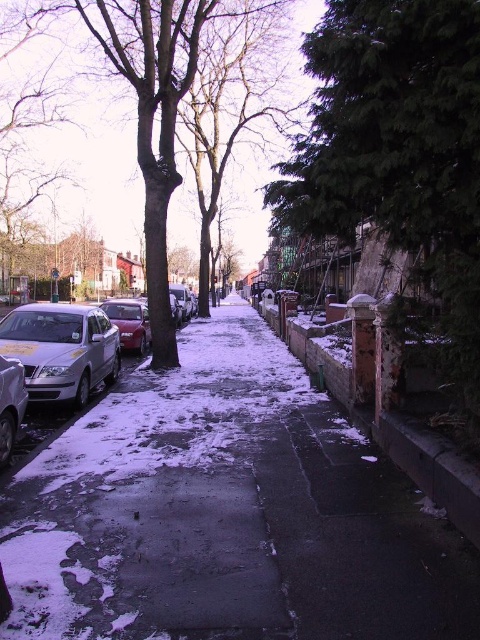
Question: Among these objects, which one is nearest to the camera?

Choices:
 (A) shiny red car at left
 (B) silver metallic car at left

Answer: (B)

Question: Which of the following is the farthest from the observer?

Choices:
 (A) shiny red car at left
 (B) brick wall at center
 (C) silver metallic car at left
 (D) green textured tree at right

Answer: (A)

Question: From the image, what is the correct spatial relationship of snowy concrete sidewalk at center in relation to shiny red car at left?

Choices:
 (A) above
 (B) below

Answer: (B)

Question: Where is green textured tree at right located in relation to bare branches at center in the image?

Choices:
 (A) right
 (B) left

Answer: (A)

Question: Which object is the farthest from the brick wall at center?

Choices:
 (A) bare branches at center
 (B) snowy concrete sidewalk at center
 (C) silver metallic car at lower left
 (D) silver metallic car at left

Answer: (A)

Question: Is bare branches at center closer to camera compared to silver metallic car at lower left?

Choices:
 (A) no
 (B) yes

Answer: (A)